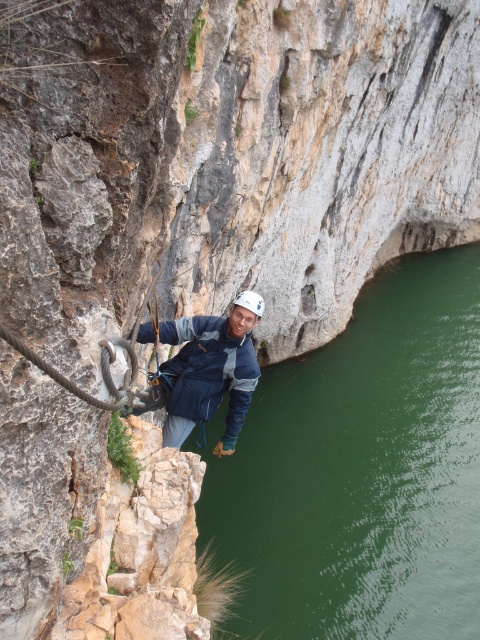
Question: Can you confirm if green liquid water at center is positioned to the left of white matte helmet at center?

Choices:
 (A) yes
 (B) no

Answer: (B)

Question: Can you confirm if blue fabric jacket at center is thinner than black rubber rope at center?

Choices:
 (A) no
 (B) yes

Answer: (A)

Question: Which of these objects is positioned farthest from the green liquid water at center?

Choices:
 (A) black rubber rope at center
 (B) blue fabric jacket at center
 (C) white matte helmet at center

Answer: (A)

Question: Where is blue fabric jacket at center located in relation to white matte helmet at center in the image?

Choices:
 (A) below
 (B) above

Answer: (A)

Question: Which point is farther to the camera?

Choices:
 (A) (121, 401)
 (B) (231, 360)
 (C) (253, 298)

Answer: (B)

Question: Which point appears farthest from the camera in this image?

Choices:
 (A) (304, 486)
 (B) (237, 294)
 (C) (218, 384)
 (D) (23, 352)

Answer: (A)